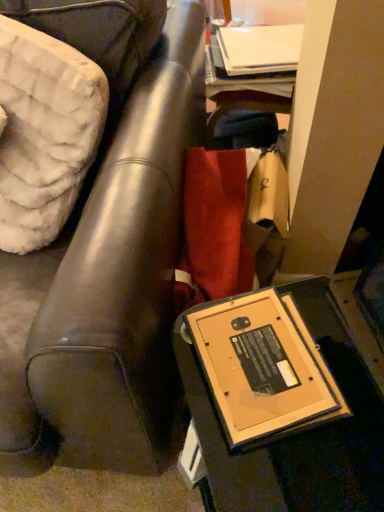
The height and width of the screenshot is (512, 384). What do you see at coordinates (282, 403) in the screenshot?
I see `wooden table at lower right` at bounding box center [282, 403].

The width and height of the screenshot is (384, 512). In order to click on wooden table at lower right in this screenshot , I will do `click(282, 403)`.

This screenshot has width=384, height=512. Describe the element at coordinates (109, 291) in the screenshot. I see `matte black frame at lower right` at that location.

Image resolution: width=384 pixels, height=512 pixels. I want to click on matte black frame at lower right, so click(x=109, y=291).

Find the location of a particular element. wooden table at lower right is located at coordinates (282, 403).

Considering the relative positions of matte black frame at lower right and wooden table at lower right in the image provided, is matte black frame at lower right to the right of wooden table at lower right from the viewer's perspective?

In fact, matte black frame at lower right is to the left of wooden table at lower right.

Is the position of matte black frame at lower right more distant than that of wooden table at lower right?

No, matte black frame at lower right is closer to the viewer.

Is point (7, 355) in front of point (312, 311)?

Yes, point (7, 355) is closer to viewer.

From the image's perspective, is matte black frame at lower right positioned above or below wooden table at lower right?

matte black frame at lower right is situated higher than wooden table at lower right in the image.

From a real-world perspective, is matte black frame at lower right beneath wooden table at lower right?

No, from a real-world perspective, matte black frame at lower right is not under wooden table at lower right.

Which of these two, matte black frame at lower right or wooden table at lower right, is wider?

Wider between the two is matte black frame at lower right.

Who is taller, matte black frame at lower right or wooden table at lower right?

With more height is matte black frame at lower right.

Between matte black frame at lower right and wooden table at lower right, which one has smaller size?

With smaller size is wooden table at lower right.

Is matte black frame at lower right spatially inside wooden table at lower right, or outside of it?

matte black frame at lower right exists outside the volume of wooden table at lower right.

Is matte black frame at lower right far from wooden table at lower right?

That's not correct — matte black frame at lower right is a little close to wooden table at lower right.

Is wooden table at lower right at the back of matte black frame at lower right?

No, matte black frame at lower right is not facing away from wooden table at lower right.

Can you tell me how much matte black frame at lower right and wooden table at lower right differ in facing direction?

matte black frame at lower right and wooden table at lower right are facing 69.4 degrees away from each other.

Identify the location of table on the right of matte black frame at lower right. click(x=282, y=403).

Which is more to the right, wooden table at lower right or matte black frame at lower right?

From the viewer's perspective, wooden table at lower right appears more on the right side.

Does wooden table at lower right lie in front of matte black frame at lower right?

That is False.

Considering the positions of point (274, 389) and point (166, 372), is point (274, 389) closer or farther from the camera than point (166, 372)?

Point (274, 389) is closer to the camera than point (166, 372).

From the image's perspective, is wooden table at lower right on matte black frame at lower right?

Incorrect, from the image's perspective, wooden table at lower right is lower than matte black frame at lower right.

From a real-world perspective, who is located higher, wooden table at lower right or matte black frame at lower right?

matte black frame at lower right.

Considering the sizes of wooden table at lower right and matte black frame at lower right in the image, is wooden table at lower right wider or thinner than matte black frame at lower right?

wooden table at lower right is thinner than matte black frame at lower right.

In terms of height, does wooden table at lower right look taller or shorter compared to matte black frame at lower right?

In the image, wooden table at lower right appears to be shorter than matte black frame at lower right.

Considering the sizes of objects wooden table at lower right and matte black frame at lower right in the image provided, who is smaller, wooden table at lower right or matte black frame at lower right?

wooden table at lower right is smaller.

Is wooden table at lower right outside of matte black frame at lower right?

Yes, wooden table at lower right is outside of matte black frame at lower right.

Is wooden table at lower right not close to matte black frame at lower right?

Actually, wooden table at lower right and matte black frame at lower right are a little close together.

Is wooden table at lower right oriented away from matte black frame at lower right?

wooden table at lower right is not turned away from matte black frame at lower right.

How many degrees apart are the facing directions of wooden table at lower right and matte black frame at lower right?

They differ by 69.4 degrees in their facing directions.

How much distance is there between wooden table at lower right and matte black frame at lower right?

8.93 inches.

The width and height of the screenshot is (384, 512). I want to click on table located underneath the matte black frame at lower right (from a real-world perspective), so click(x=282, y=403).

Where is `furniture above the wooden table at lower right (from the image's perspective)`? This screenshot has width=384, height=512. furniture above the wooden table at lower right (from the image's perspective) is located at coordinates (109, 291).

What are the coordinates of `furniture in front of the wooden table at lower right` in the screenshot? It's located at (109, 291).